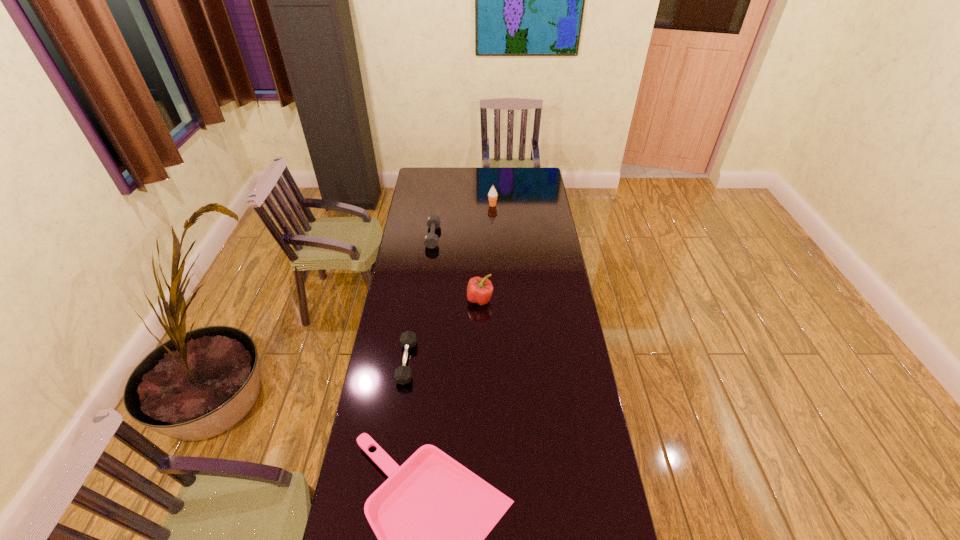
Where is `free point between the third nearest object and the fourth nearest object`? free point between the third nearest object and the fourth nearest object is located at coordinates (456, 268).

The height and width of the screenshot is (540, 960). What are the coordinates of `vacant area between the second farthest object and the bell pepper` in the screenshot? It's located at (456, 268).

Image resolution: width=960 pixels, height=540 pixels. In order to click on free area in between the icecream and the third farthest object in this screenshot , I will do `click(487, 252)`.

Identify the location of vacant space that's between the icecream and the nearer dumbbell. (449, 284).

Locate an element on the screen. The width and height of the screenshot is (960, 540). vacant area that lies between the fourth nearest object and the fourth farthest object is located at coordinates (420, 299).

Image resolution: width=960 pixels, height=540 pixels. In order to click on vacant space that's between the third nearest object and the nearer dumbbell in this screenshot , I will do `click(444, 330)`.

Locate an element on the screen. The image size is (960, 540). object that is the fourth closest one to the nearest object is located at coordinates (492, 195).

Identify which object is located as the second nearest to the second farthest object. Please provide its 2D coordinates. Your answer should be formatted as a tuple, i.e. [(x, y)], where the tuple contains the x and y coordinates of a point satisfying the conditions above.

[(479, 290)]